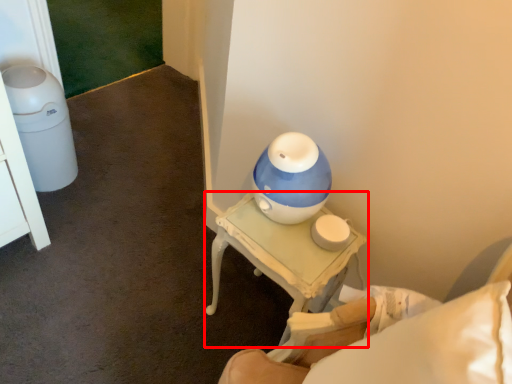
Question: From the image's perspective, where is table (annotated by the red box) located relative to furniture?

Choices:
 (A) below
 (B) above

Answer: (B)